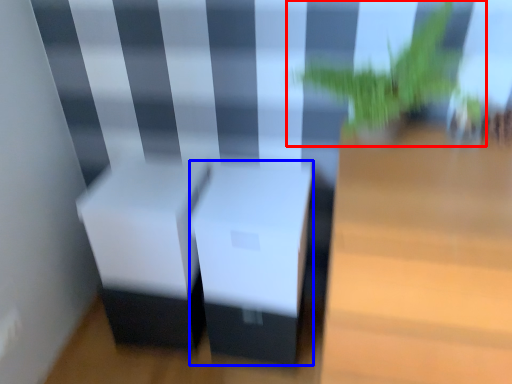
Question: Which object is further to the camera taking this photo, houseplant (highlighted by a red box) or table (highlighted by a blue box)?

Choices:
 (A) houseplant
 (B) table

Answer: (B)